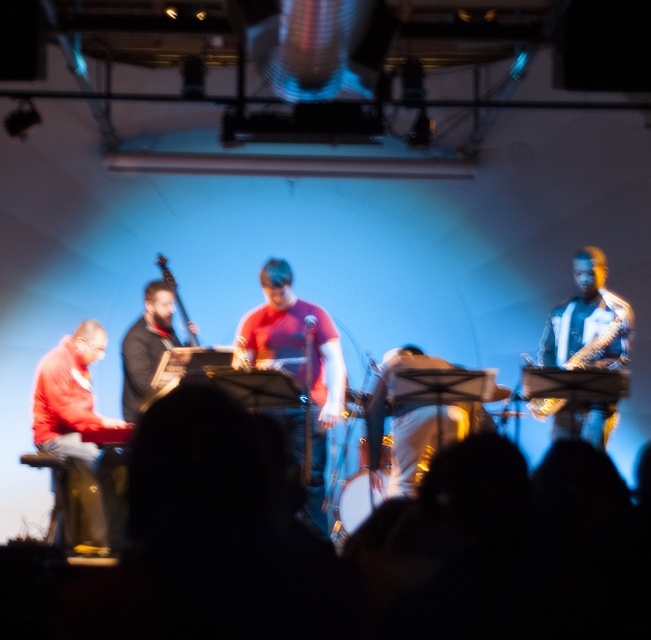
You are a stagehand who needs to adjust the lighting for the performers. You notice the matte red shirt at center and the matte black bass at center. Which object should you adjust the lighting for first if you want to highlight the taller one?

The matte red shirt at center has a greater height compared to the matte black bass at center, so you should adjust the lighting for the matte red shirt at center first to highlight its height.

You are a stagehand who needs to place a 30 inch wide decorative panel between the matte red shirt at center and the matte black bass at center. Will the panel fit without overlapping either object?

The distance between the matte red shirt at center and the matte black bass at center is 30.10 inches. Since the panel is 30 inches wide, there is a 0.10 inch gap, so the panel can fit without overlapping either object.